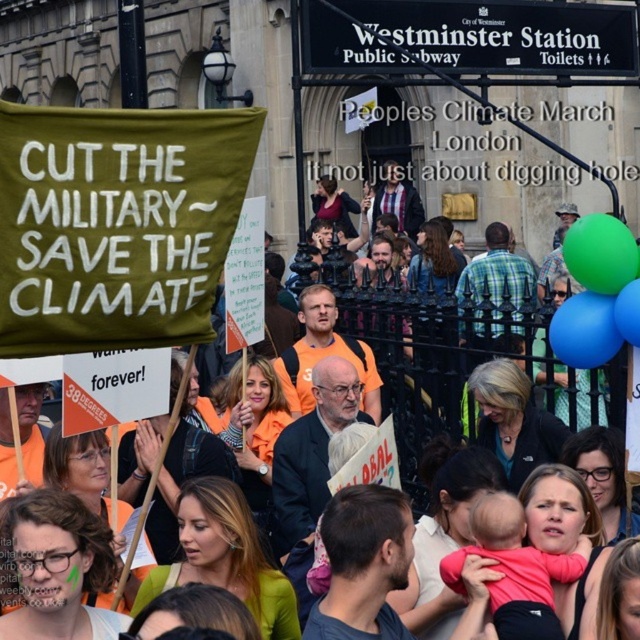
How distant is green fabric banner at upper left from pink fabric baby at lower center?

10.31 meters

Find the location of a particular element. The image size is (640, 640). green fabric banner at upper left is located at coordinates (440, 348).

This screenshot has width=640, height=640. In order to click on green fabric banner at upper left in this screenshot , I will do `click(440, 348)`.